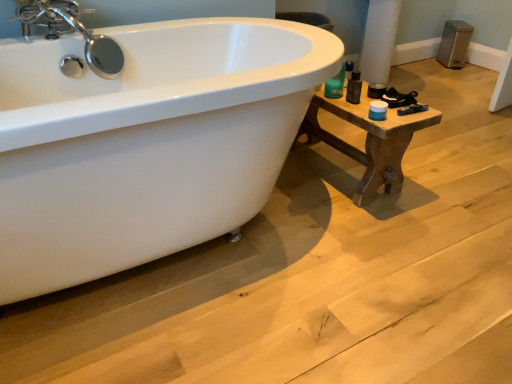
Where is `vacant space situated on the left part of matte black container at right`? The image size is (512, 384). vacant space situated on the left part of matte black container at right is located at coordinates (351, 89).